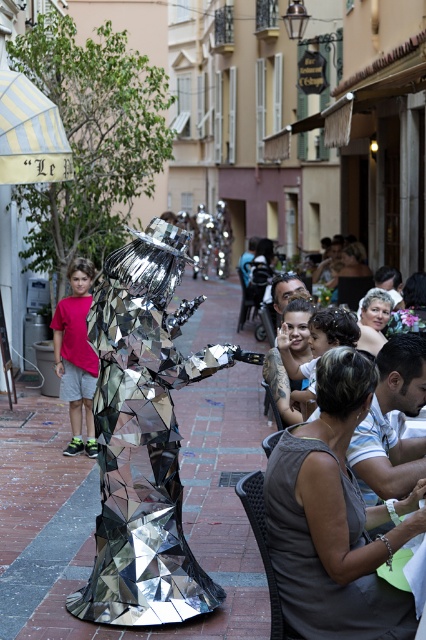
You are a tourist holding a camera and want to take a photo of both the reflective metallic figure at center and the shiny metallic robot at lower right. Which object should you focus on first to ensure both are in the frame?

You should focus on the reflective metallic figure at center first because it is closer to the viewer than the shiny metallic robot at lower right, so adjusting the camera to include both would require starting with the closer object.

You are a tourist standing on the street and want to take a photo of the shiny metallic robot at lower right without the mirrored metallic sculpture at center blocking it. How should you position yourself to achieve this?

The shiny metallic robot at lower right is behind the mirrored metallic sculpture at center, so you should move to a position where the sculpture is no longer between you and the robot. Moving to the side or behind the sculpture might allow you to capture the robot without obstruction.

You are a street performer planning to set up a small stage between the reflective metallic figure at center and the shiny metallic robot at lower right. Given that your stage requires a minimum width of 2 meters, can you determine if there is enough space between them based on their sizes?

The reflective metallic figure at center is wider than the shiny metallic robot at lower right, but the exact distance between them isn